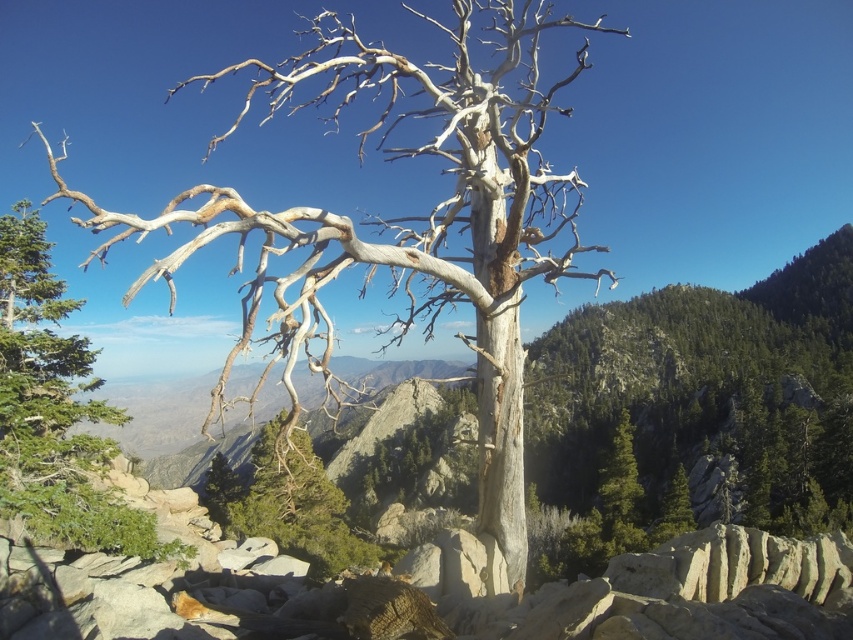
Which is in front, point (15, 285) or point (339, 493)?

Point (15, 285) is more forward.

Does gray bark tree at upper left have a lesser width compared to green textured pine tree at center?

Yes, gray bark tree at upper left is thinner than green textured pine tree at center.

You are a GUI agent. You are given a task and a screenshot of the screen. Output one action in this format:
    pyautogui.click(x=<x>, y=<y>)
    Task: Click on the gray bark tree at upper left
    
    Given the screenshot: What is the action you would take?
    tap(55, 412)

Locate an element on the screen. gray bark tree at upper left is located at coordinates (55, 412).

Is point (489, 340) positioned after point (48, 387)?

No, (489, 340) is closer to viewer.

This screenshot has height=640, width=853. What do you see at coordinates (404, 216) in the screenshot? I see `gray bark tree at center` at bounding box center [404, 216].

The width and height of the screenshot is (853, 640). Find the location of `gray bark tree at center`. gray bark tree at center is located at coordinates (404, 216).

Between gray bark tree at center and green textured pine tree at center, which one has less height?

green textured pine tree at center

Is gray bark tree at center in front of green textured pine tree at center?

Yes, it is in front of green textured pine tree at center.

Identify the location of gray bark tree at center. This screenshot has height=640, width=853. (404, 216).

Locate an element on the screen. The height and width of the screenshot is (640, 853). gray bark tree at center is located at coordinates (404, 216).